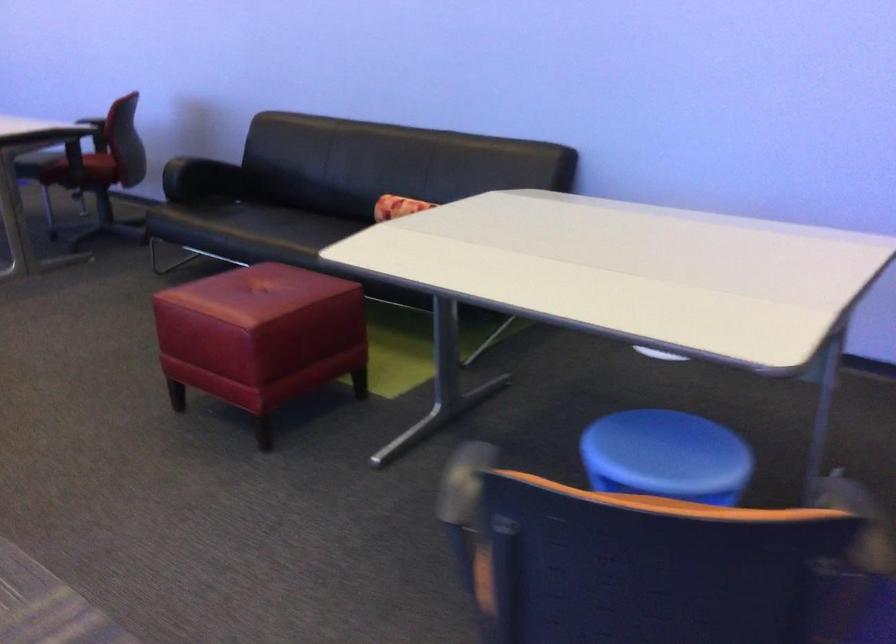
Find the location of `red leather ottoman`. red leather ottoman is located at coordinates (261, 337).